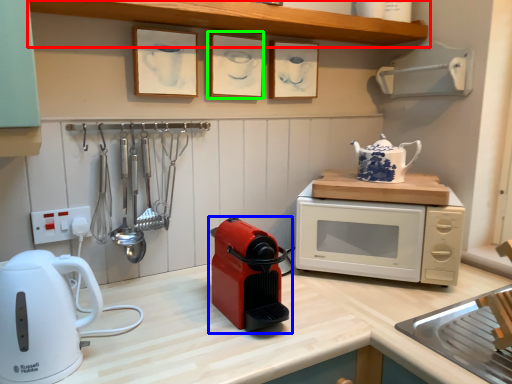
Question: Which object is positioned closest to shelf (highlighted by a red box)? Select from home appliance (highlighted by a blue box) and picture frame (highlighted by a green box).

Choices:
 (A) home appliance
 (B) picture frame

Answer: (B)